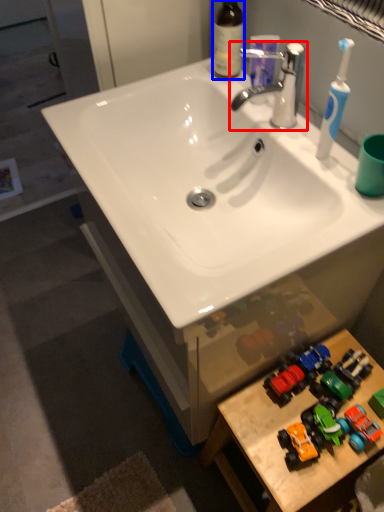
Question: Which object appears closest to the camera in this image, tap (highlighted by a red box) or bottle (highlighted by a blue box)?

Choices:
 (A) tap
 (B) bottle

Answer: (A)